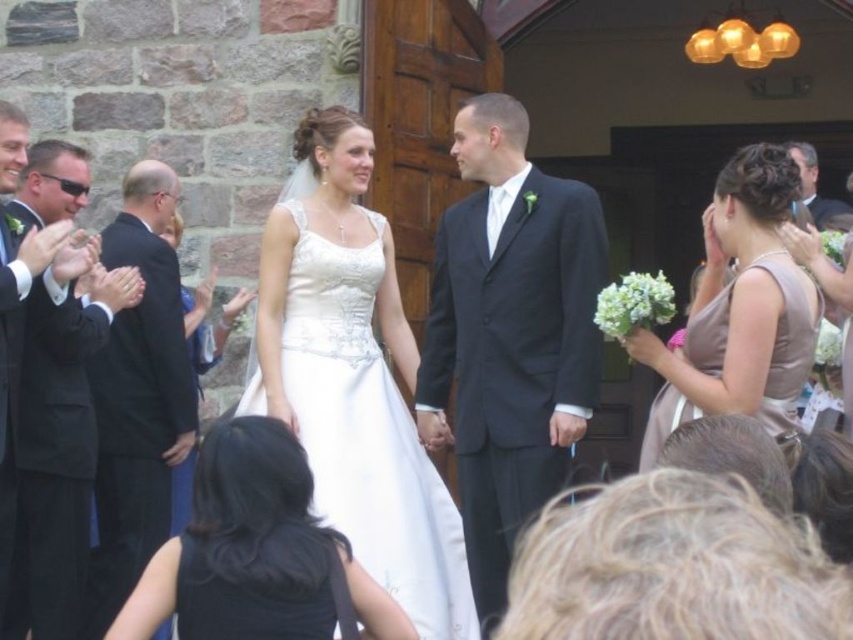
Based on the photo, you are a photographer at the wedding and want to capture a photo of the white satin dress at center and the black satin suit at left. Based on their positions, which one is more to the right?

The white satin dress at center is positioned on the right side of the black satin suit at left, so the white satin dress at center is more to the right.

You are a photographer at the wedding and need to position the black suit at left and the black satin suit at left so that they are both visible in the frame. Which one should be moved closer to the camera to ensure both are fully visible?

The black suit at left has a lesser width compared to the black satin suit at left, so moving the black satin suit at left closer to the camera will allow both to be fully visible in the frame.